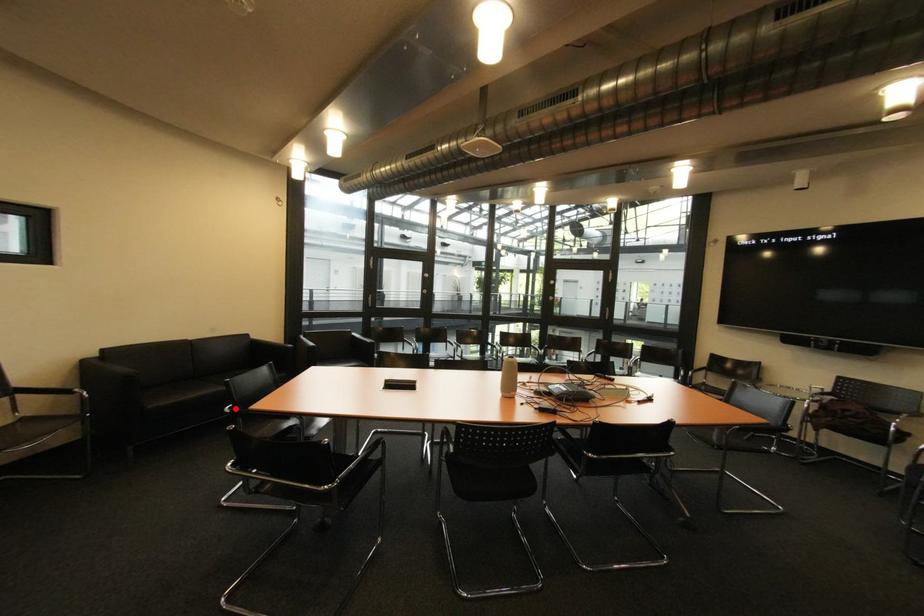
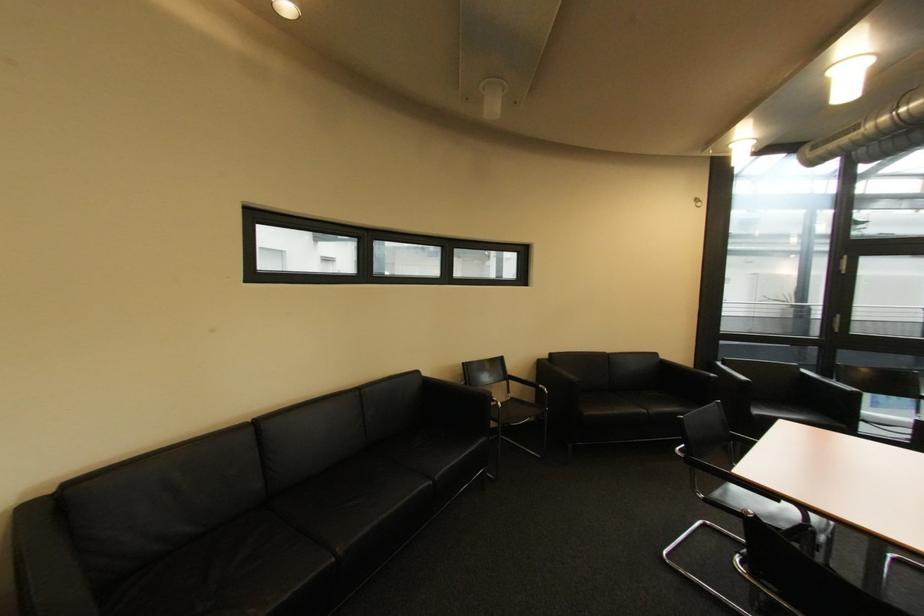
Find the pixel in the second image that matches the highlighted location in the first image.

(686, 450)